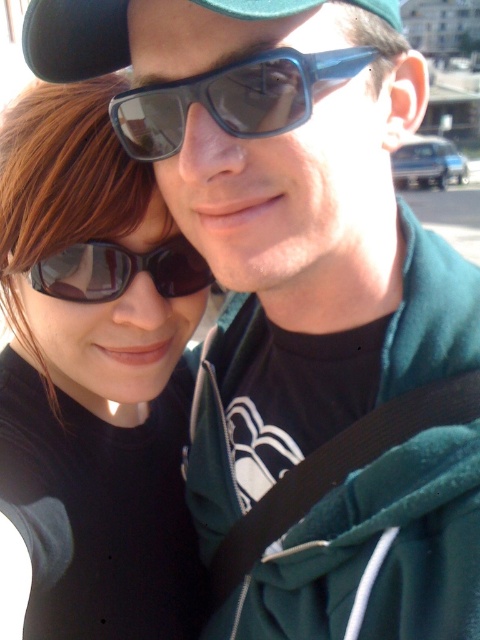
You are a photographer adjusting the lighting for a portrait. You notice the green fabric baseball cap at upper center and the matte black sunglasses at center in the frame. Which object is covering part of the other?

The green fabric baseball cap at upper center is positioned over the matte black sunglasses at center, so it is covering part of the matte black sunglasses at center.